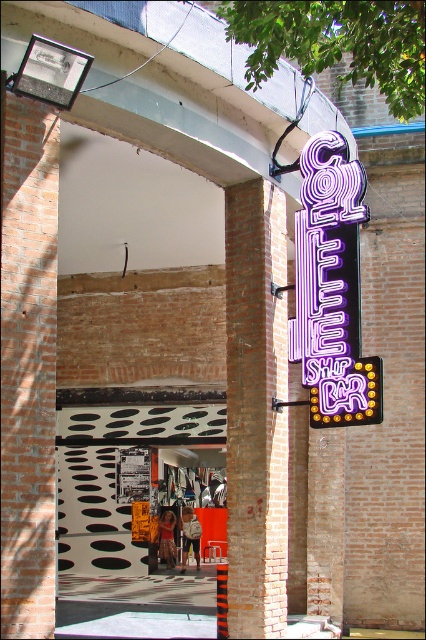
Question: Which of the following is the farthest from the observer?

Choices:
 (A) neon purple sign at right
 (B) brick at center

Answer: (B)

Question: Can you confirm if brick at center is positioned above neon purple sign at right?

Choices:
 (A) no
 (B) yes

Answer: (A)

Question: In this image, where is brick at center located relative to neon purple sign at right?

Choices:
 (A) right
 (B) left

Answer: (B)

Question: Is brick at center positioned at the back of neon purple sign at right?

Choices:
 (A) no
 (B) yes

Answer: (B)

Question: Which of the following is the closest to the observer?

Choices:
 (A) brick at center
 (B) neon purple sign at right

Answer: (B)

Question: Among these objects, which one is nearest to the camera?

Choices:
 (A) brick at center
 (B) neon purple sign at right

Answer: (B)